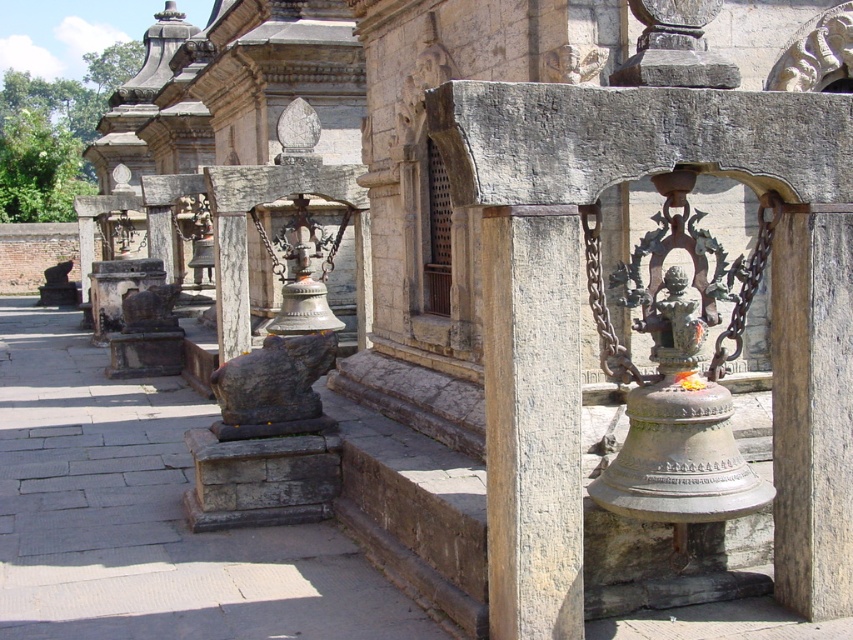
You are standing at the entrance of the temple and want to visit both the brown stone pillar at center and the rusty stone statue at center. If you start at the entrance, which object will you reach first?

The brown stone pillar at center and the rusty stone statue at center are both at center, so you will reach them at the same time.

You are standing in front of the traditional stone structure and notice two points marked in the image. Which of the two points, point [578,452] or point [248,408], is closer to your eyes?

Point [578,452] is closer to the camera than point [248,408], so it is closer to your eyes.

You are a visitor standing in front of the temple structure and see the brown stone pillar at center and the rusty stone statue at center. Which object is positioned higher relative to the other?

The brown stone pillar at center is above the rusty stone statue at center, so it is positioned higher.